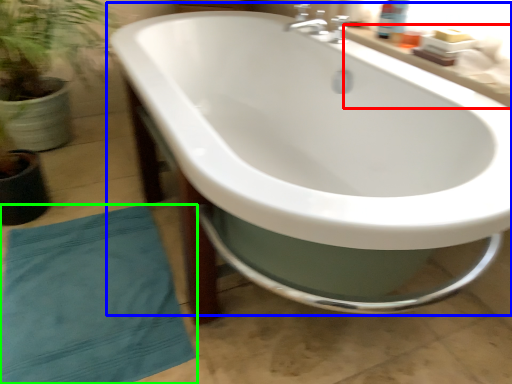
Question: Based on their relative distances, which object is nearer to counter top (highlighted by a red box)? Choose from bathtub (highlighted by a blue box) and beach towel (highlighted by a green box).

Choices:
 (A) bathtub
 (B) beach towel

Answer: (A)